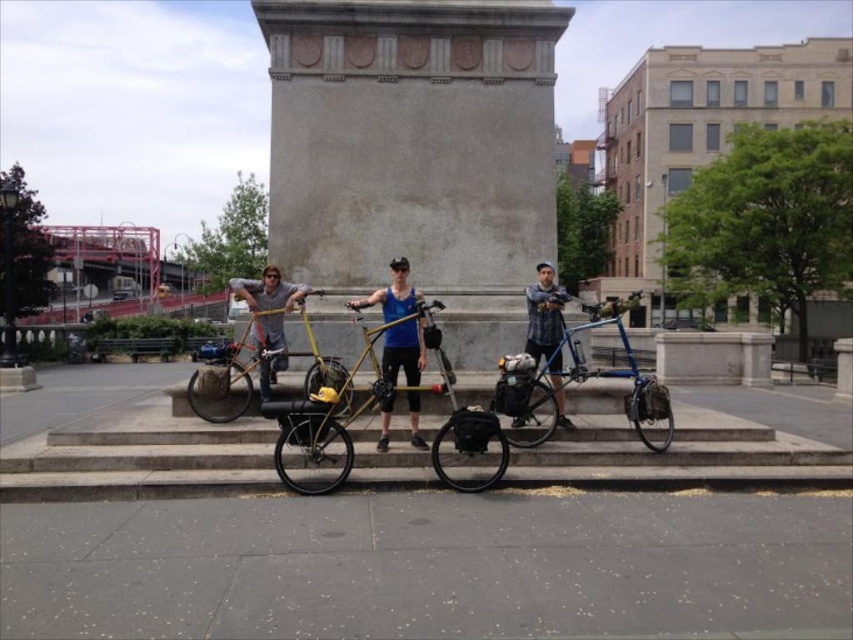
Question: Considering the relative positions of smooth concrete monument at center and gold matte bicycle at center in the image provided, where is smooth concrete monument at center located with respect to gold matte bicycle at center?

Choices:
 (A) left
 (B) right

Answer: (B)

Question: Which object is closer to the camera taking this photo?

Choices:
 (A) yellow matte bicycle at center
 (B) blue tank top at center

Answer: (B)

Question: Among these points, which one is nearest to the camera?

Choices:
 (A) (253, 307)
 (B) (376, 202)
 (C) (556, 397)
 (D) (213, 392)

Answer: (C)

Question: Is blue metallic bicycle at center wider than plaid flannel shirt at center?

Choices:
 (A) yes
 (B) no

Answer: (A)

Question: Can you confirm if yellow matte bicycle at center is positioned to the right of plaid flannel shirt at center?

Choices:
 (A) yes
 (B) no

Answer: (B)

Question: Which point is closer to the camera?

Choices:
 (A) blue metallic bicycle at center
 (B) gold matte bicycle at center

Answer: (B)